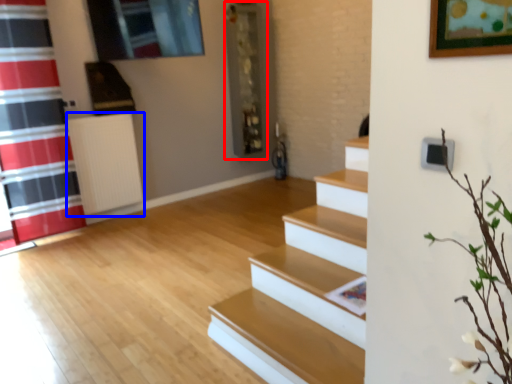
Question: Which point is further to the camera, shelf (highlighted by a red box) or radiator (highlighted by a blue box)?

Choices:
 (A) shelf
 (B) radiator

Answer: (A)